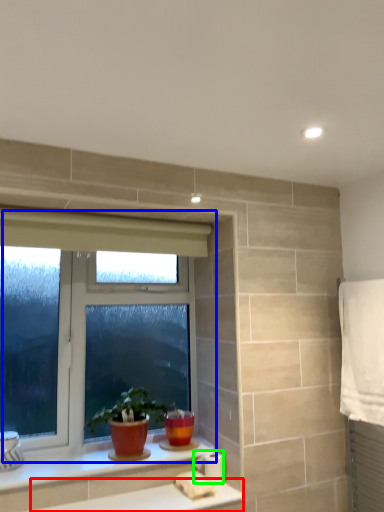
Question: Which is farther away from counter top (highlighted by a red box)? window (highlighted by a blue box) or toilet paper (highlighted by a green box)?

Choices:
 (A) window
 (B) toilet paper

Answer: (A)